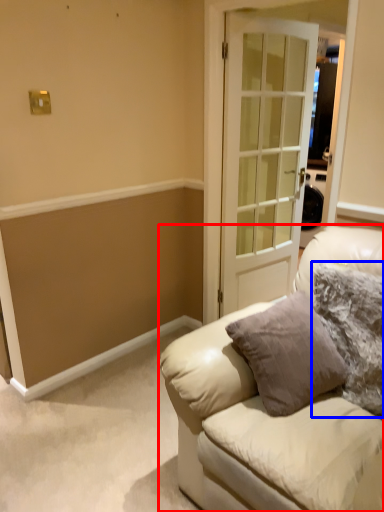
Question: Which of the following is the farthest to the observer, studio couch (highlighted by a red box) or pillow (highlighted by a blue box)?

Choices:
 (A) studio couch
 (B) pillow

Answer: (B)